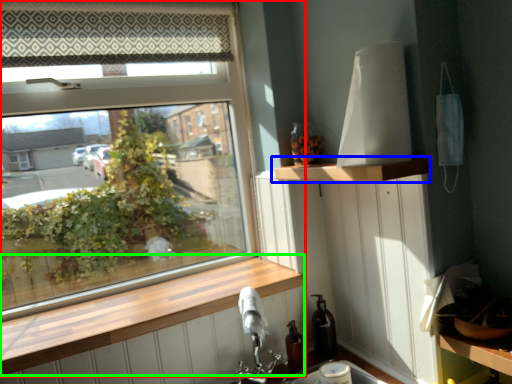
Question: Based on their relative distances, which object is farther from window (highlighted by a red box)? Choose from shelf (highlighted by a blue box) and window sill (highlighted by a green box).

Choices:
 (A) shelf
 (B) window sill

Answer: (A)